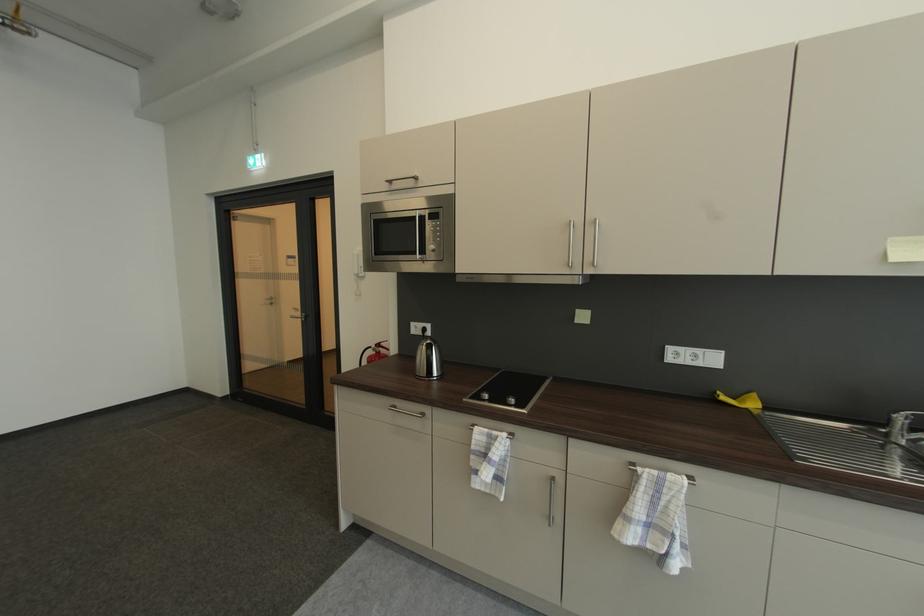
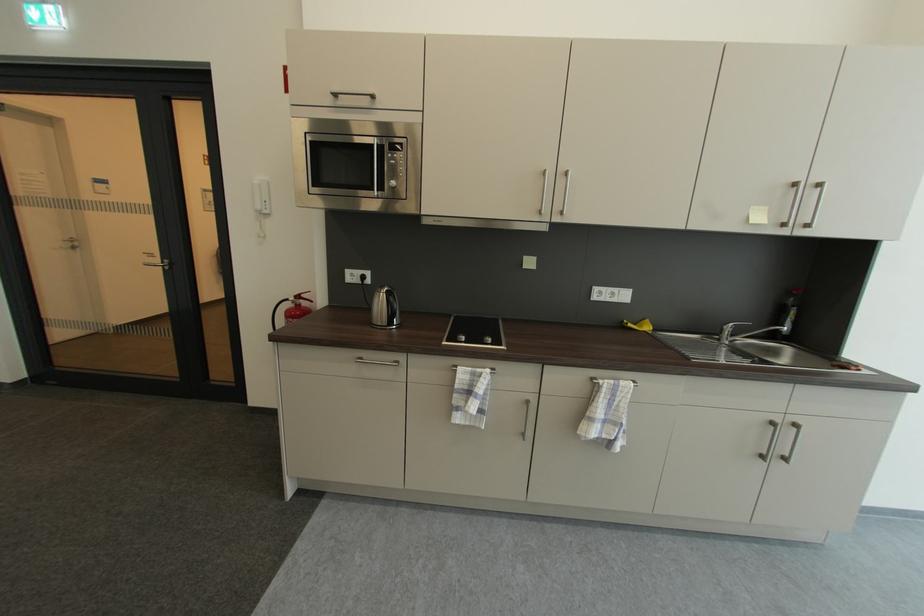
The point at (430, 254) is marked in the first image. Where is the corresponding point in the second image?

(387, 188)